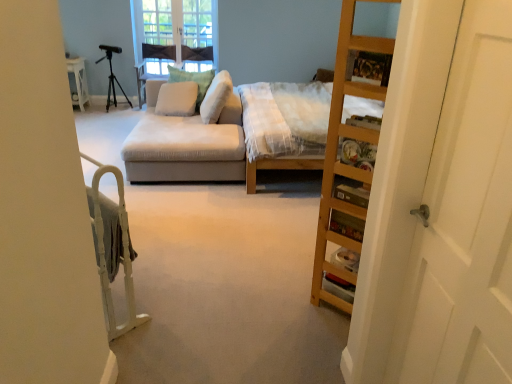
At what (x,y) coordinates should I click in order to perform the action: click on vacant area that lies between wooden bookshelf at right and white wood bed frame at left. Please return your answer as a coordinate pair (x, y). The height and width of the screenshot is (384, 512). Looking at the image, I should click on tap(227, 296).